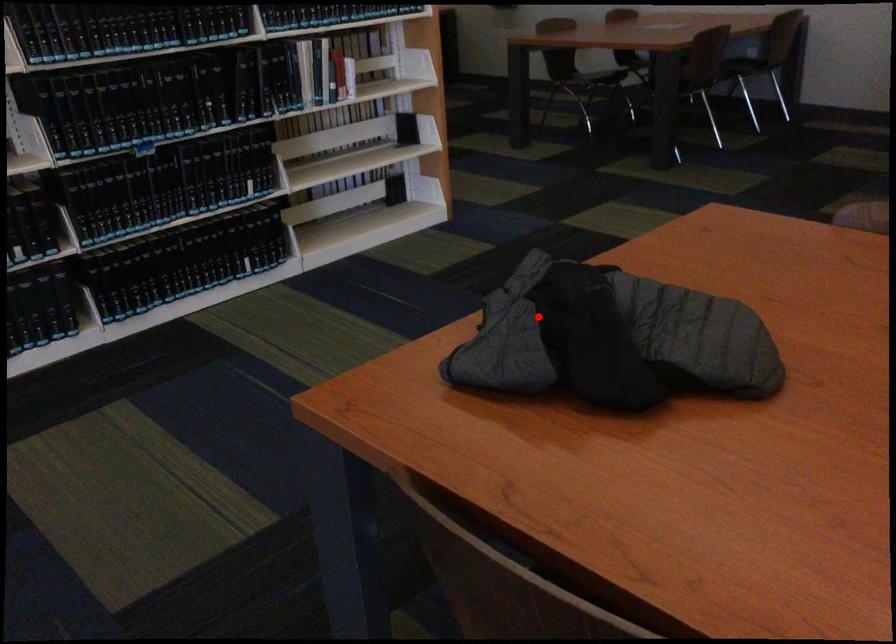
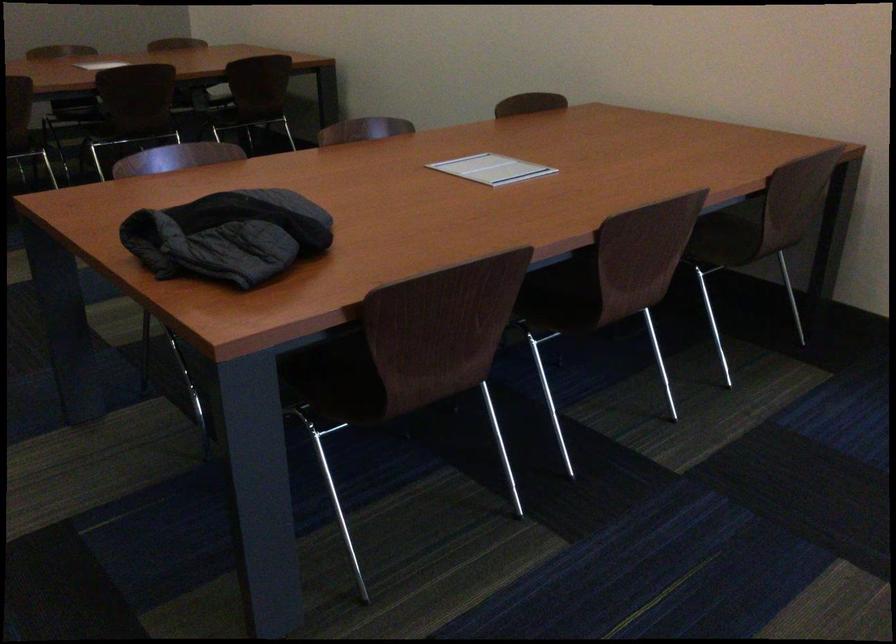
Question: A red point is marked in image1. In image2, is the corresponding 3D point closer to the camera or farther? Reply with the corresponding letter.

Choices:
 (A) The corresponding 3D point is closer.
 (B) The corresponding 3D point is farther.

Answer: (B)